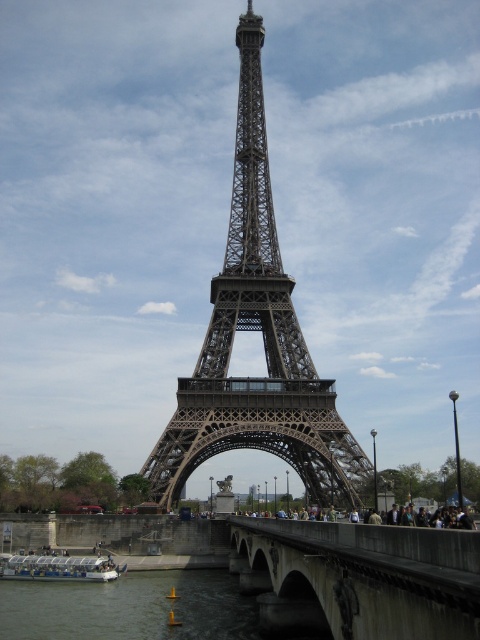
Question: Which object appears closest to the camera in this image?

Choices:
 (A) metallic structure at center
 (B) white plastic boat at lower left
 (C) smooth water at lower center
 (D) concrete bridge at center

Answer: (D)

Question: Does concrete bridge at center come behind smooth water at lower center?

Choices:
 (A) no
 (B) yes

Answer: (A)

Question: Does smooth water at lower center lie in front of white plastic boat at lower left?

Choices:
 (A) no
 (B) yes

Answer: (B)

Question: Estimate the real-world distances between objects in this image. Which object is farther from the metallic structure at center?

Choices:
 (A) white plastic boat at lower left
 (B) concrete bridge at center

Answer: (A)

Question: Among these objects, which one is farthest from the camera?

Choices:
 (A) smooth water at lower center
 (B) white plastic boat at lower left
 (C) metallic structure at center

Answer: (B)

Question: Can you confirm if concrete bridge at center is positioned below smooth water at lower center?

Choices:
 (A) no
 (B) yes

Answer: (A)